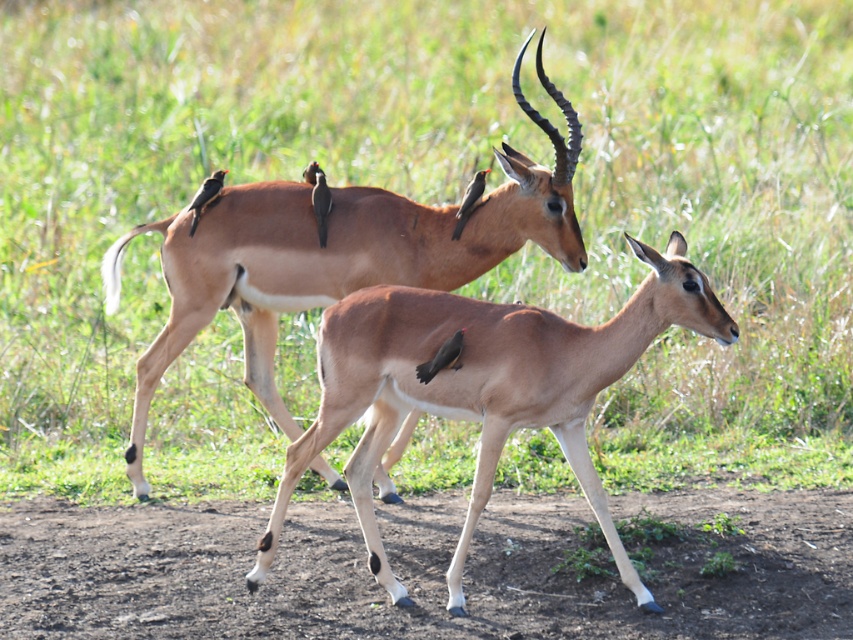
Question: Which object appears closest to the camera in this image?

Choices:
 (A) brown glossy antelope at center
 (B) light brown smooth deer at center

Answer: (B)

Question: Can you confirm if brown glossy antelope at center is positioned below light brown smooth deer at center?

Choices:
 (A) yes
 (B) no

Answer: (B)

Question: Is brown glossy antelope at center behind light brown smooth deer at center?

Choices:
 (A) no
 (B) yes

Answer: (B)

Question: Which point is closer to the camera taking this photo?

Choices:
 (A) (408, 355)
 (B) (227, 291)

Answer: (A)

Question: Can you confirm if brown glossy antelope at center is positioned above light brown smooth deer at center?

Choices:
 (A) yes
 (B) no

Answer: (A)